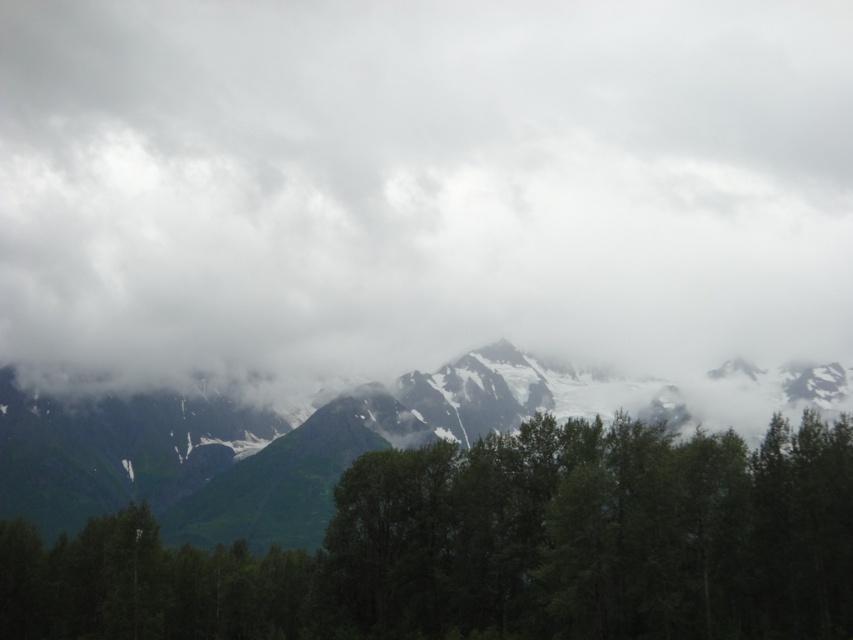
Question: Is white fluffy cloud at upper center behind green grassy mountain range at center?

Choices:
 (A) yes
 (B) no

Answer: (A)

Question: Considering the relative positions of white fluffy cloud at upper center and green grassy mountain range at center in the image provided, where is white fluffy cloud at upper center located with respect to green grassy mountain range at center?

Choices:
 (A) left
 (B) right

Answer: (B)

Question: Does white fluffy cloud at upper center have a larger size compared to green grassy mountain range at center?

Choices:
 (A) no
 (B) yes

Answer: (A)

Question: Which object appears farthest from the camera in this image?

Choices:
 (A) white fluffy cloud at upper center
 (B) green grassy mountain range at center

Answer: (A)

Question: Among these objects, which one is nearest to the camera?

Choices:
 (A) white fluffy cloud at upper center
 (B) green grassy mountain range at center

Answer: (B)